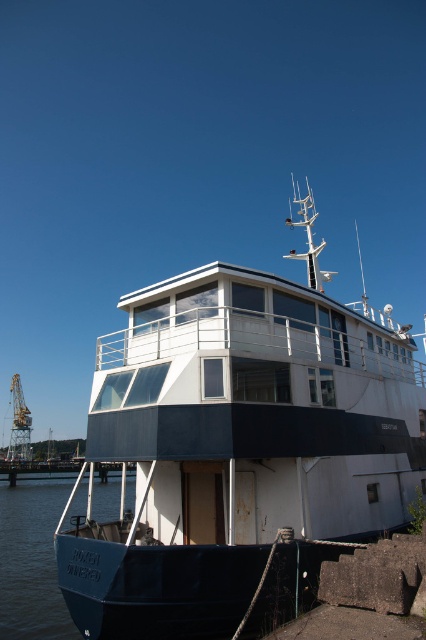
This screenshot has height=640, width=426. What do you see at coordinates (238, 449) in the screenshot?
I see `white matte cabin cruiser at center` at bounding box center [238, 449].

Who is positioned more to the left, white matte cabin cruiser at center or teal rubber boat at lower left?

teal rubber boat at lower left is more to the left.

Image resolution: width=426 pixels, height=640 pixels. I want to click on white matte cabin cruiser at center, so click(238, 449).

Where is `white matte cabin cruiser at center`? This screenshot has width=426, height=640. white matte cabin cruiser at center is located at coordinates (238, 449).